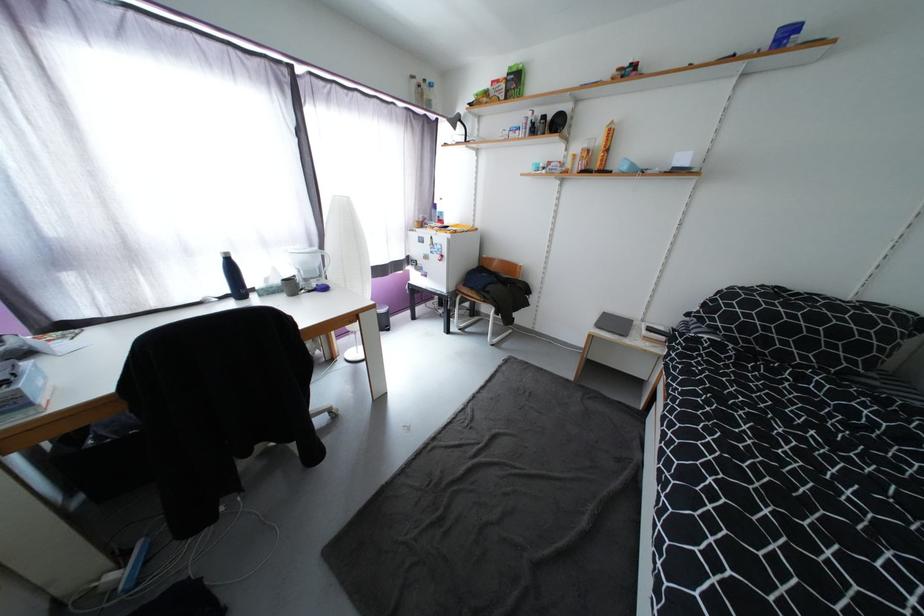
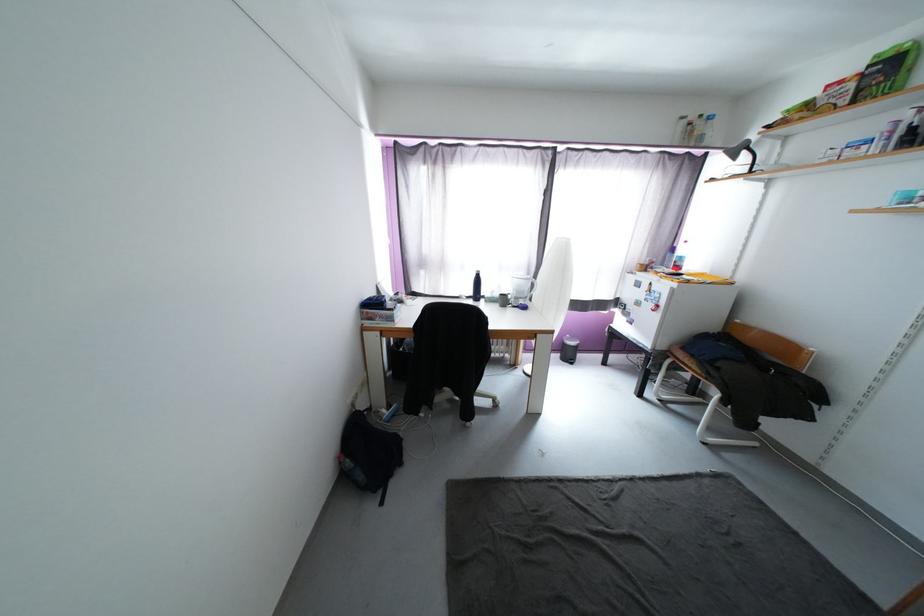
In the second image, find the point that corresponds to pixel 282 283 in the first image.

(503, 296)